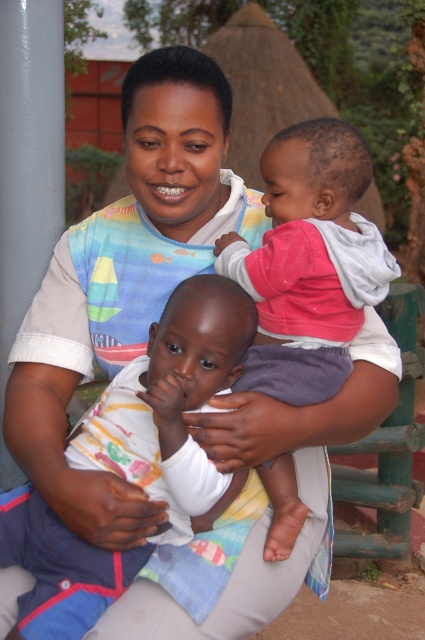
Looking at the scene, which object has a greater width between the white cotton shirt at center and the soft pink fabric at upper right?

The white cotton shirt at center has a greater width than the soft pink fabric at upper right.

You are a photographer standing 1.5 meters away from the camera. You want to take a photo of the white cotton shirt at center. Can you reach it without moving closer?

The white cotton shirt at center and camera are 1.27 meters apart. Since you are 1.5 meters away from the camera, the total distance between you and the white cotton shirt at center is 2.77 meters. This distance is likely too far to reach the shirt without moving closer, so you would need to step forward to get within a reachable distance.

You are standing in front of the woman holding the two children and want to place a gift at the point closer to you between point (173, 372) and point (319, 332). Which point should you choose?

Point (173, 372) is in front of point (319, 332), so you should choose point (173, 372) to place the gift closer to you.